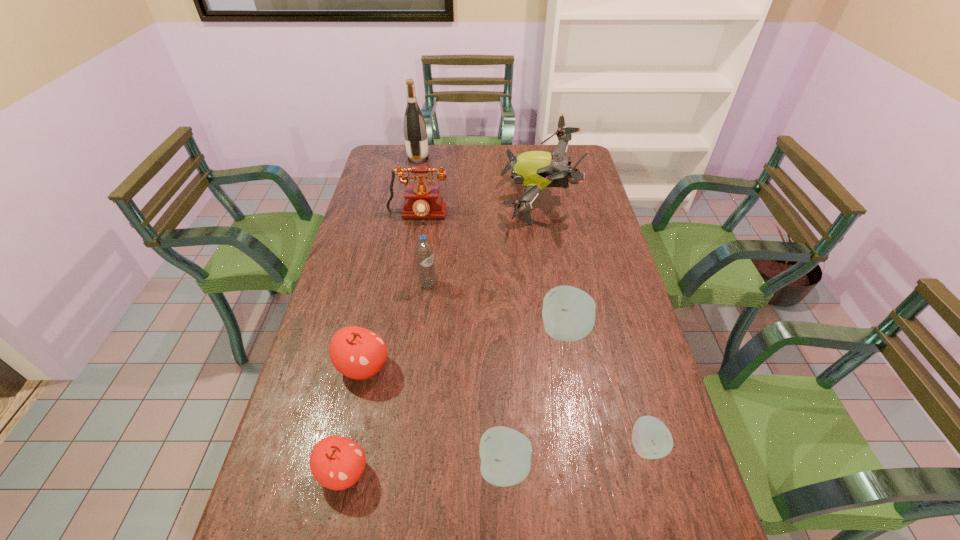
Where is `drone that is at the right edge`? Image resolution: width=960 pixels, height=540 pixels. drone that is at the right edge is located at coordinates (536, 170).

Locate an element on the screen. object positioned at the far left corner is located at coordinates (415, 132).

You are a GUI agent. You are given a task and a screenshot of the screen. Output one action in this format:
    pyautogui.click(x=<x>, y=<y>)
    Task: Click on the object at the far right corner
    
    Given the screenshot: What is the action you would take?
    pyautogui.click(x=536, y=170)

At what (x,y) coordinates should I click in order to perform the action: click on vacant point at the far edge. Please return your answer as a coordinate pair (x, y). Looking at the image, I should click on point(445,144).

The height and width of the screenshot is (540, 960). What are the coordinates of `free spot at the left edge of the desktop` in the screenshot? It's located at (378, 177).

Locate an element on the screen. This screenshot has width=960, height=540. vacant space at the right edge of the desktop is located at coordinates (586, 175).

Find the location of `vacant space in between the leftmost white apple and the water bottle`. vacant space in between the leftmost white apple and the water bottle is located at coordinates pyautogui.click(x=467, y=376).

Locate an element on the screen. vacant area that lies between the second smallest white apple and the second tallest object is located at coordinates (520, 334).

Locate an element on the screen. free space between the sixth nearest object and the second biggest white apple is located at coordinates (467, 376).

This screenshot has height=540, width=960. I want to click on empty location between the farthest object and the second apple from right to left, so click(492, 245).